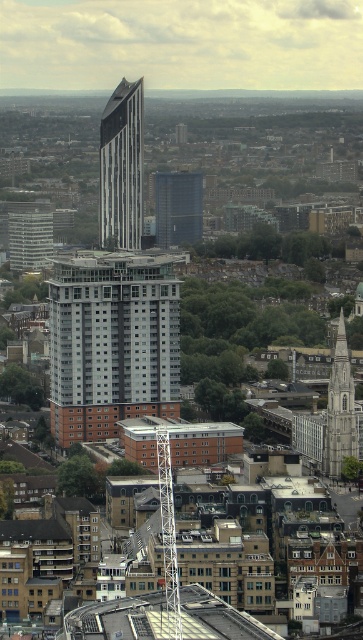
Question: Is dark blue glass building at center smaller than white metal spire at center?

Choices:
 (A) no
 (B) yes

Answer: (B)

Question: Which point appears closest to the camera in this image?

Choices:
 (A) (124, 180)
 (B) (67, 417)
 (C) (174, 580)
 (D) (181, 177)

Answer: (C)

Question: Does white concrete building at center appear on the left side of black glass tower at center?

Choices:
 (A) yes
 (B) no

Answer: (A)

Question: Among these objects, which one is farthest from the camera?

Choices:
 (A) dark blue glass building at center
 (B) stone tower at center
 (C) white concrete building at center
 (D) black glass tower at center

Answer: (A)

Question: Can you confirm if white concrete building at center is bigger than stone tower at center?

Choices:
 (A) no
 (B) yes

Answer: (B)

Question: Among these objects, which one is farthest from the camera?

Choices:
 (A) dark blue glass building at center
 (B) white metal spire at center
 (C) stone tower at center
 (D) black glass tower at center

Answer: (A)